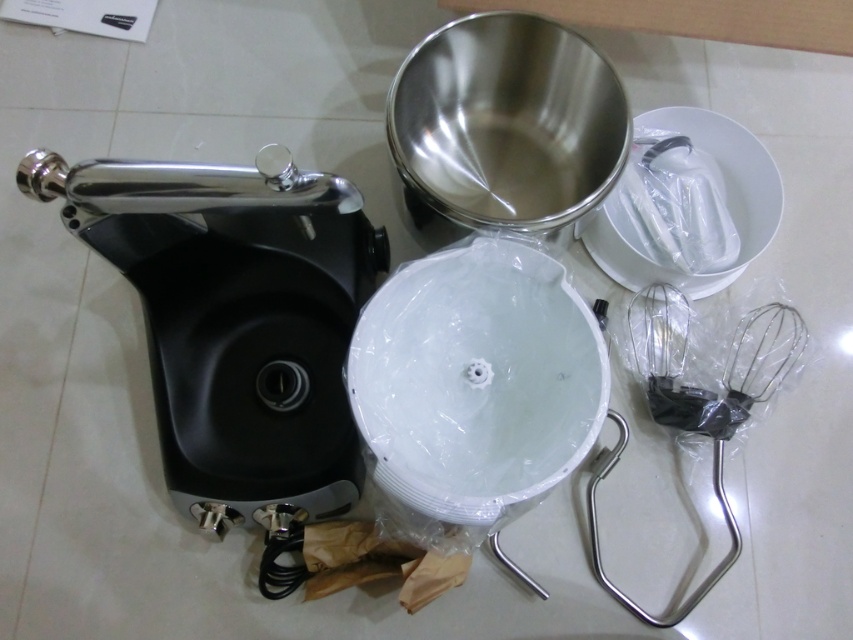
Who is higher up, polished metal stand mixer at left or silver metallic whisk at lower right?

polished metal stand mixer at left

Does polished metal stand mixer at left come in front of silver metallic whisk at lower right?

Yes.

Between point (80, 216) and point (718, 422), which one is positioned in front?

Point (80, 216) is in front.

This screenshot has width=853, height=640. I want to click on polished metal stand mixer at left, so click(x=236, y=321).

Consider the image. Is white plastic sink at center closer to camera compared to stainless steel mixing bowl at upper center?

Yes.

What do you see at coordinates (476, 380) in the screenshot?
I see `white plastic sink at center` at bounding box center [476, 380].

Identify the location of white plastic sink at center. Image resolution: width=853 pixels, height=640 pixels. point(476,380).

Who is taller, polished metal stand mixer at left or white plastic basin at center?

Standing taller between the two is polished metal stand mixer at left.

Between point (154, 381) and point (618, 244), which one is positioned behind?

The point (618, 244) is more distant.

Image resolution: width=853 pixels, height=640 pixels. I want to click on polished metal stand mixer at left, so click(x=236, y=321).